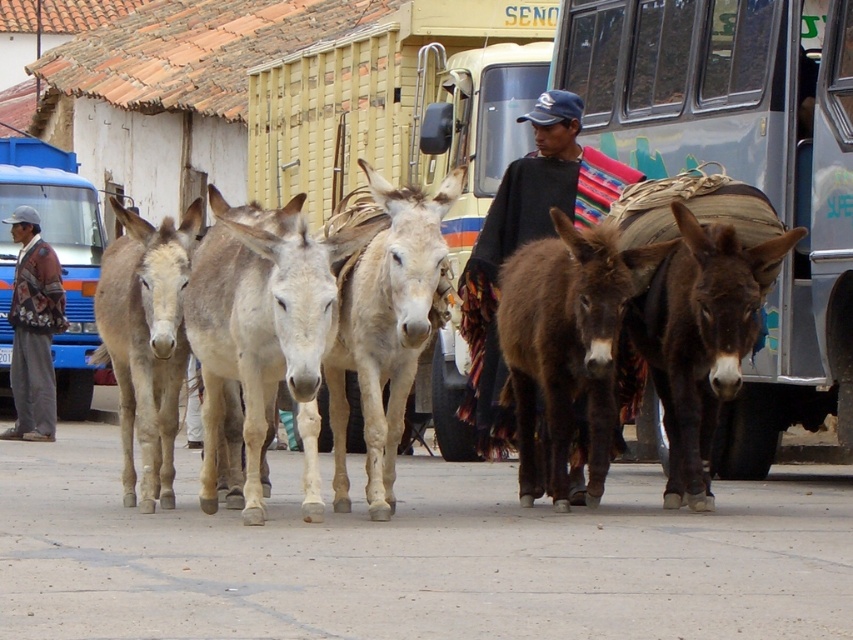
Does light beige fur at center appear on the left side of light brown fur mule at left?

Incorrect, light beige fur at center is not on the left side of light brown fur mule at left.

Does light beige fur at center have a lesser height compared to light brown fur mule at left?

In fact, light beige fur at center may be taller than light brown fur mule at left.

Identify the location of light beige fur at center. (262, 330).

Between light beige fur at center and floral-patterned jacket at left, which one is positioned lower?

Positioned lower is light beige fur at center.

What do you see at coordinates (262, 330) in the screenshot? This screenshot has width=853, height=640. I see `light beige fur at center` at bounding box center [262, 330].

Is point (305, 380) positioned before point (32, 282)?

Yes, point (305, 380) is in front of point (32, 282).

Where is `light beige fur at center`? The height and width of the screenshot is (640, 853). light beige fur at center is located at coordinates (262, 330).

Between black woven poncho at center and floral-patterned jacket at left, which one has more height?

floral-patterned jacket at left is taller.

Between point (589, 211) and point (54, 321), which one is positioned in front?

Point (589, 211)

Where is `black woven poncho at center`? The image size is (853, 640). black woven poncho at center is located at coordinates (515, 248).